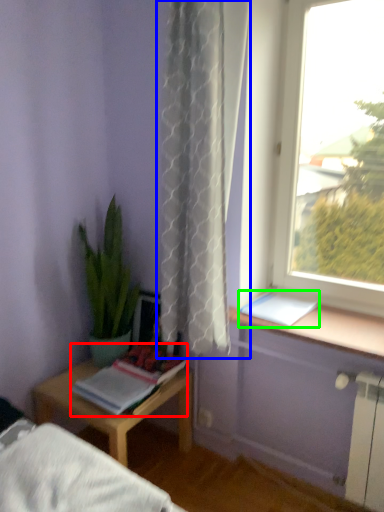
Question: Based on their relative distances, which object is nearer to book (highlighted by a red box)? Choose from curtain (highlighted by a blue box) and book (highlighted by a green box).

Choices:
 (A) curtain
 (B) book

Answer: (B)